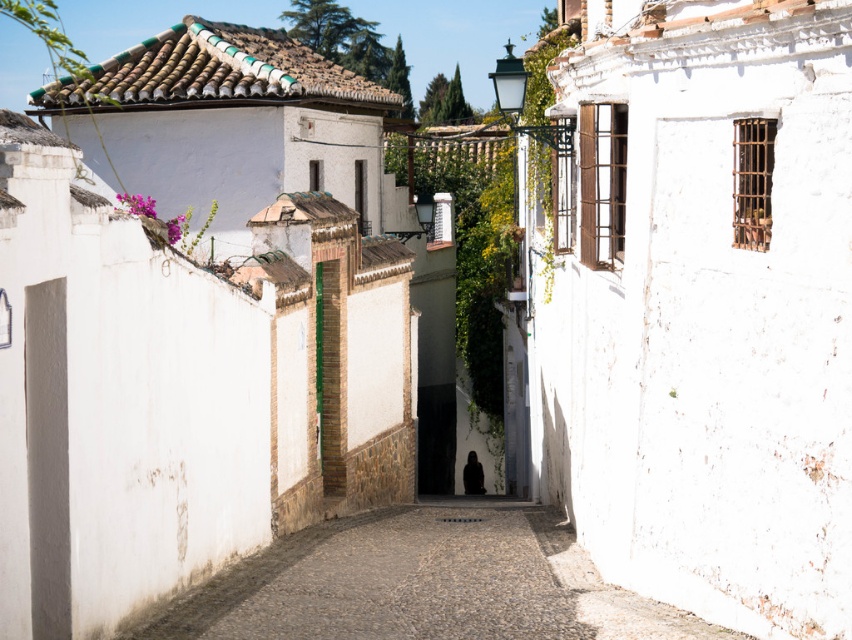
Which is above, white textured wall at right or white stone alley at center?

A: Positioned higher is white textured wall at right.

Which is more to the left, white textured wall at right or white stone alley at center?

Positioned to the left is white stone alley at center.

Does point (734, 163) lie in front of point (375, 552)?

Yes.

Find the location of a particular element. This screenshot has height=640, width=852. white textured wall at right is located at coordinates (699, 305).